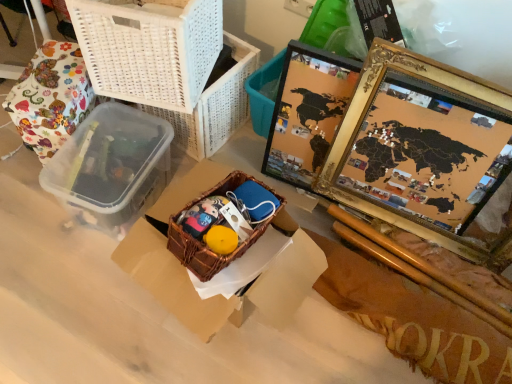
Measure the distance between point (219,187) and camera.

Point (219,187) and camera are 3.77 feet apart from each other.

This screenshot has height=384, width=512. What do you see at coordinates (205, 250) in the screenshot?
I see `woven brown basket at center` at bounding box center [205, 250].

Describe the element at coordinates (149, 48) in the screenshot. I see `white woven basket at upper left` at that location.

Find the location of a particular element. This screenshot has height=384, width=512. floral fabric wrapped object at left is located at coordinates (50, 97).

The height and width of the screenshot is (384, 512). What do you see at coordinates (173, 283) in the screenshot?
I see `brown woven basket at center` at bounding box center [173, 283].

Locate an element on the screen. This screenshot has height=384, width=512. transparent plastic lunch box at left is located at coordinates (111, 168).

Locate an element on the screen. Image resolution: width=512 pixels, height=384 pixels. woven brown basket at center is located at coordinates click(x=205, y=250).

The width and height of the screenshot is (512, 384). Find the location of `wrapping paper that appears behind the woven brown basket at center`. wrapping paper that appears behind the woven brown basket at center is located at coordinates (50, 97).

Considering the sizes of objects floral fabric wrapped object at left and woven brown basket at center in the image provided, who is shorter, floral fabric wrapped object at left or woven brown basket at center?

woven brown basket at center.

Can you confirm if floral fabric wrapped object at left is smaller than woven brown basket at center?

No, floral fabric wrapped object at left is not smaller than woven brown basket at center.

How distant is floral fabric wrapped object at left from woven brown basket at center?

floral fabric wrapped object at left is 23.36 inches from woven brown basket at center.

Is woven brown basket at center aimed at transparent plastic lunch box at left?

No.

How many degrees apart are the facing directions of woven brown basket at center and transparent plastic lunch box at left?

The facing directions of woven brown basket at center and transparent plastic lunch box at left are 18.6 degrees apart.

From a real-world perspective, is woven brown basket at center physically above transparent plastic lunch box at left?

Indeed, from a real-world perspective, woven brown basket at center stands above transparent plastic lunch box at left.

Is woven brown basket at center taller or shorter than transparent plastic lunch box at left?

In the image, woven brown basket at center appears to be shorter than transparent plastic lunch box at left.

Is woven brown basket at center situated inside gold-framed map at right or outside?

woven brown basket at center is outside gold-framed map at right.

Is woven brown basket at center positioned in front of gold-framed map at right?

That is False.

Is woven brown basket at center to the left of gold-framed map at right from the viewer's perspective?

Correct, you'll find woven brown basket at center to the left of gold-framed map at right.

From a real-world perspective, is woven brown basket at center on gold-framed map at right?

Correct, in the physical world, woven brown basket at center is higher than gold-framed map at right.

From a real-world perspective, is white woven basket at upper left located beneath woven brown basket at center?

No, from a real-world perspective, white woven basket at upper left is not below woven brown basket at center.

Does white woven basket at upper left have a greater height compared to woven brown basket at center?

Yes, white woven basket at upper left is taller than woven brown basket at center.

Is woven brown basket at center at the back of white woven basket at upper left?

white woven basket at upper left is not turned away from woven brown basket at center.

Can you tell me how much white woven basket at upper left and woven brown basket at center differ in facing direction?

28 degrees.

Between floral fabric wrapped object at left and white woven basket at upper left, which one is positioned behind?

floral fabric wrapped object at left.

Considering the positions of objects floral fabric wrapped object at left and white woven basket at upper left in the image provided, who is more to the right, floral fabric wrapped object at left or white woven basket at upper left?

Positioned to the right is white woven basket at upper left.

From the image's perspective, would you say floral fabric wrapped object at left is shown under white woven basket at upper left?

Indeed, from the image's perspective, floral fabric wrapped object at left is shown beneath white woven basket at upper left.

Is transparent plastic lunch box at left in front of woven brown basket at center?

No, transparent plastic lunch box at left is behind woven brown basket at center.

Does transparent plastic lunch box at left have a greater height compared to woven brown basket at center?

Indeed, transparent plastic lunch box at left has a greater height compared to woven brown basket at center.

Is transparent plastic lunch box at left turned away from woven brown basket at center?

No, transparent plastic lunch box at left is not facing away from woven brown basket at center.

Which is correct: transparent plastic lunch box at left is inside woven brown basket at center, or outside of it?

transparent plastic lunch box at left is outside woven brown basket at center.

Based on the photo, can you tell me how much brown woven basket at center and floral fabric wrapped object at left differ in facing direction?

brown woven basket at center and floral fabric wrapped object at left are facing 28.9 degrees away from each other.

Looking at this image, is brown woven basket at center far from floral fabric wrapped object at left?

brown woven basket at center is actually quite close to floral fabric wrapped object at left.

Between brown woven basket at center and floral fabric wrapped object at left, which one has larger size?

With larger size is brown woven basket at center.

Is brown woven basket at center at the left side of floral fabric wrapped object at left?

No, brown woven basket at center is not to the left of floral fabric wrapped object at left.

You are a GUI agent. You are given a task and a screenshot of the screen. Output one action in this format:
    pyautogui.click(x=<x>, y=<y>)
    Task: Click on the gift basket above the floral fabric wrapped object at left (from a real-world perspective)
    The width and height of the screenshot is (512, 384).
    Given the screenshot: What is the action you would take?
    pyautogui.click(x=205, y=250)

Locate an element on the screen. gift basket that is on the right side of transparent plastic lunch box at left is located at coordinates (205, 250).

Based on their spatial positions, is gold-framed map at right or woven brown basket at center closer to white woven basket at upper left?

woven brown basket at center.

Estimate the real-world distances between objects in this image. Which object is closer to floral fabric wrapped object at left, brown woven basket at center or gold-framed map at right?

brown woven basket at center is closer to floral fabric wrapped object at left.

Looking at the image, which one is located closer to floral fabric wrapped object at left, gold-framed map at right or brown woven basket at center?

Among the two, brown woven basket at center is located nearer to floral fabric wrapped object at left.

In the scene shown: Based on their spatial positions, is white woven basket at upper left or transparent plastic lunch box at left closer to gold-framed map at right?

The object closer to gold-framed map at right is white woven basket at upper left.

Looking at the image, which one is located closer to transparent plastic lunch box at left, gold-framed map at right or floral fabric wrapped object at left?

The object closer to transparent plastic lunch box at left is floral fabric wrapped object at left.

When comparing their distances from woven brown basket at center, does transparent plastic lunch box at left or floral fabric wrapped object at left seem further?

floral fabric wrapped object at left lies further to woven brown basket at center than the other object.

In the scene shown: Estimate the real-world distances between objects in this image. Which object is further from woven brown basket at center, gold-framed map at right or floral fabric wrapped object at left?

The object further to woven brown basket at center is floral fabric wrapped object at left.

From the image, which object appears to be nearer to gold-framed map at right, brown woven basket at center or transparent plastic lunch box at left?

brown woven basket at center is closer to gold-framed map at right.

Where is `gift basket located between floral fabric wrapped object at left and brown woven basket at center in the left-right direction`? This screenshot has width=512, height=384. gift basket located between floral fabric wrapped object at left and brown woven basket at center in the left-right direction is located at coordinates (205, 250).

You are a GUI agent. You are given a task and a screenshot of the screen. Output one action in this format:
    pyautogui.click(x=<x>, y=<y>)
    Task: Click on the cardboard box between floral fabric wrapped object at left and gold-framed map at right
    This screenshot has height=384, width=512.
    Given the screenshot: What is the action you would take?
    pyautogui.click(x=173, y=283)

Image resolution: width=512 pixels, height=384 pixels. In order to click on wrapping paper between white woven basket at upper left and brown woven basket at center from top to bottom in this screenshot , I will do `click(50, 97)`.

Identify the location of lunch box between white woven basket at upper left and brown woven basket at center from top to bottom. (111, 168).